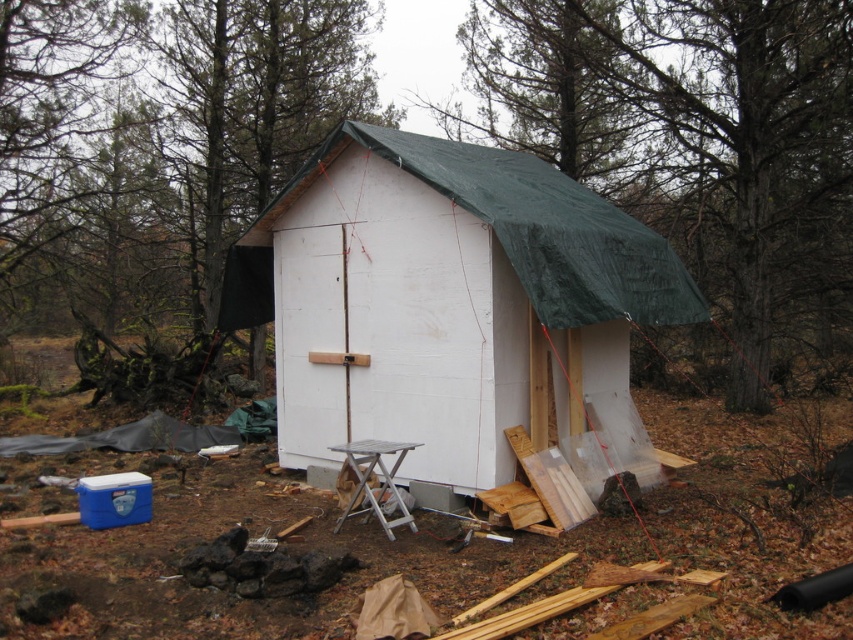
Question: Is white painted wood hut at center positioned in front of silver metallic stool at lower center?

Choices:
 (A) no
 (B) yes

Answer: (B)

Question: Does white painted wood hut at center appear on the left side of silver metallic stool at lower center?

Choices:
 (A) no
 (B) yes

Answer: (A)

Question: Which point is farther from the camera taking this photo?

Choices:
 (A) (219, 317)
 (B) (386, 477)

Answer: (A)

Question: Among these points, which one is nearest to the camera?

Choices:
 (A) (368, 440)
 (B) (323, 337)

Answer: (A)

Question: Observing the image, what is the correct spatial positioning of white painted wood hut at center in reference to silver metallic stool at lower center?

Choices:
 (A) left
 (B) right

Answer: (B)

Question: Which of the following is the farthest from the observer?

Choices:
 (A) white painted wood hut at center
 (B) silver metallic stool at lower center

Answer: (B)